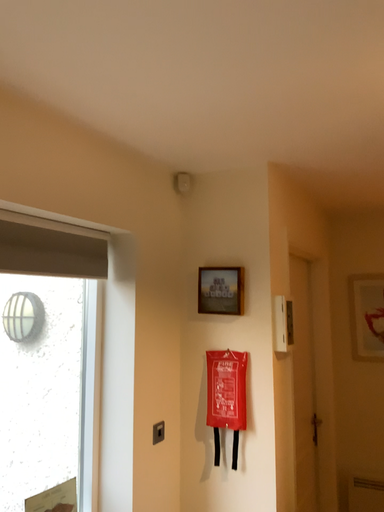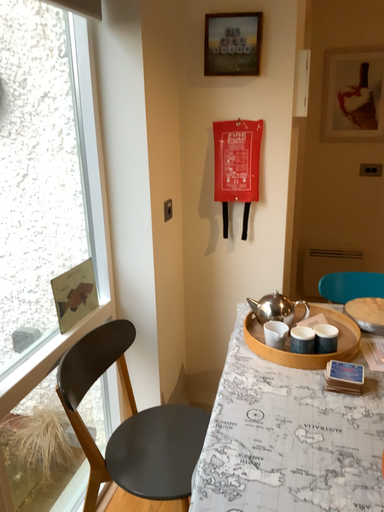
Question: Which way did the camera rotate in the video?

Choices:
 (A) rotated upward
 (B) rotated downward

Answer: (B)